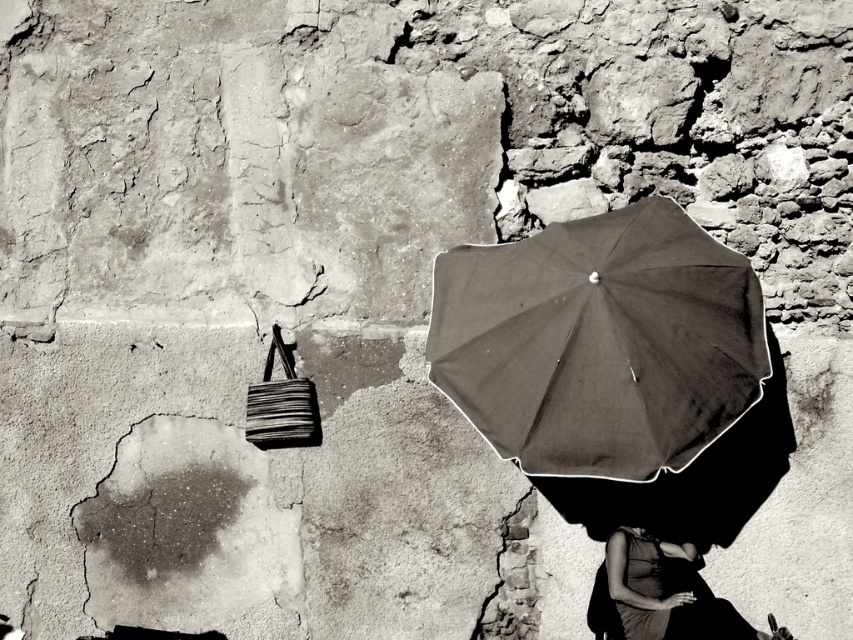
Question: Which of the following is the closest to the observer?

Choices:
 (A) smooth black dress at lower right
 (B) dark matte umbrella at center

Answer: (B)

Question: Is dark matte umbrella at center to the left of smooth black dress at lower right from the viewer's perspective?

Choices:
 (A) no
 (B) yes

Answer: (B)

Question: Is dark matte umbrella at center further to camera compared to smooth black dress at lower right?

Choices:
 (A) no
 (B) yes

Answer: (A)

Question: Is dark matte umbrella at center wider than smooth black dress at lower right?

Choices:
 (A) yes
 (B) no

Answer: (A)